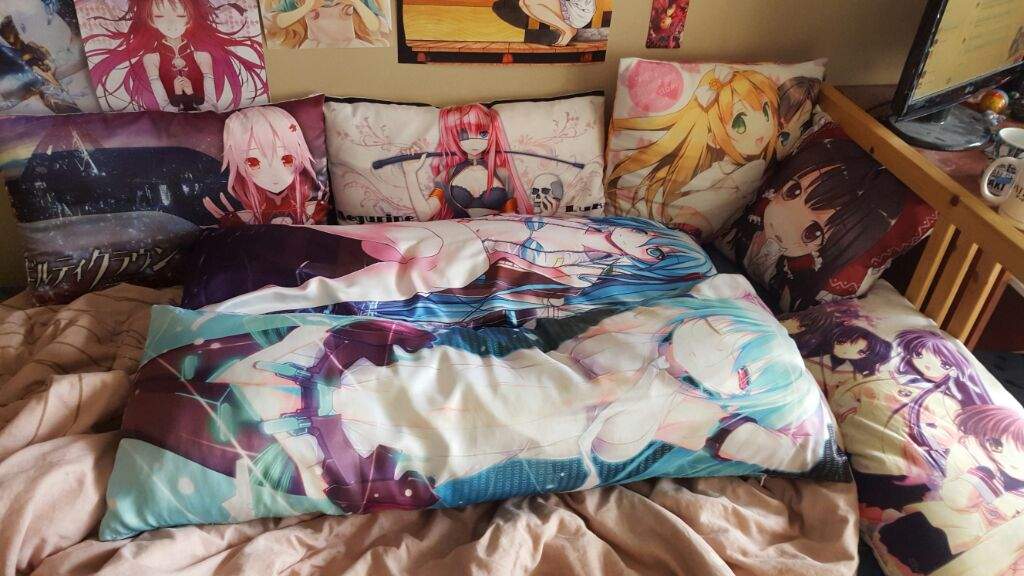
This screenshot has height=576, width=1024. In order to click on computer monitor in this screenshot , I will do `click(938, 101)`.